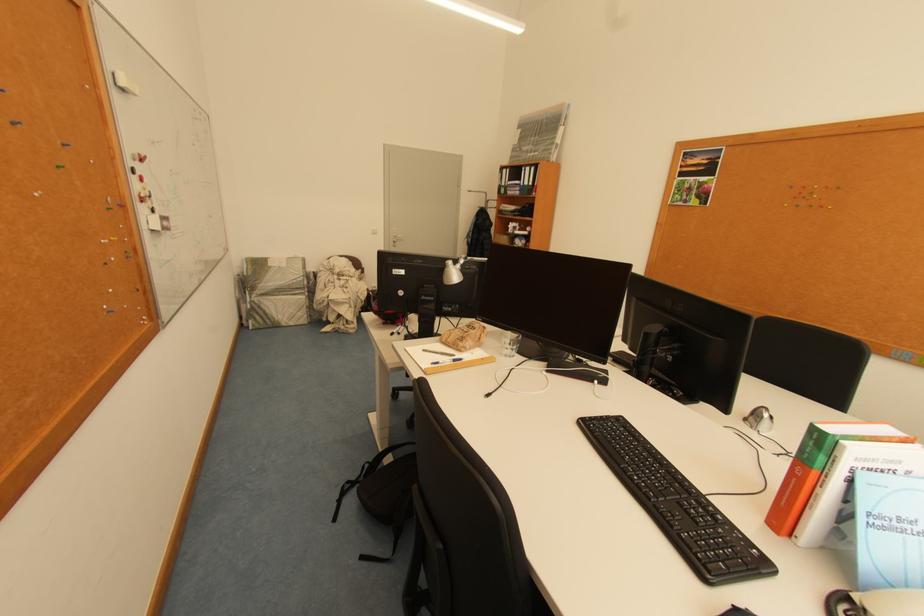
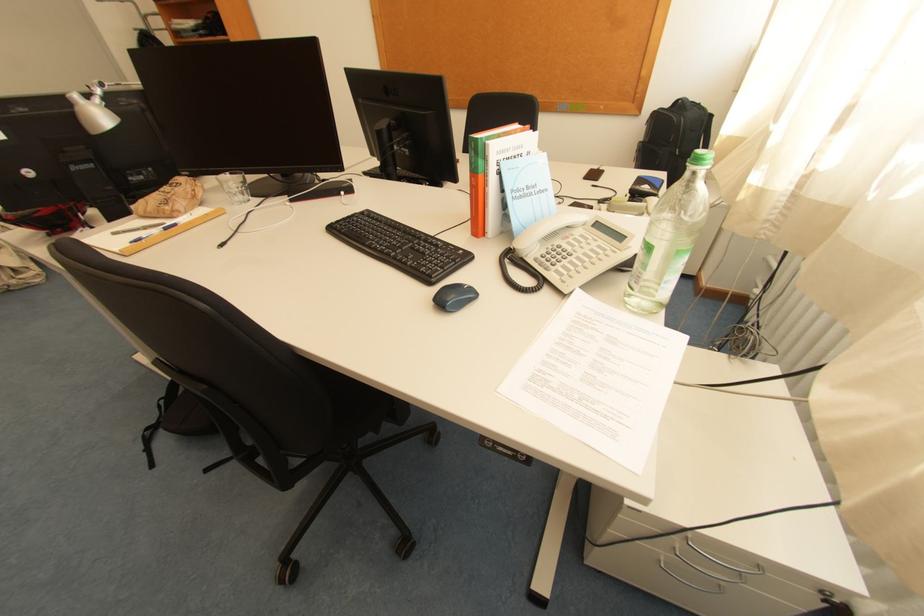
Locate, in the second image, the point that corresponds to the point at 793,501 in the first image.

(482, 211)